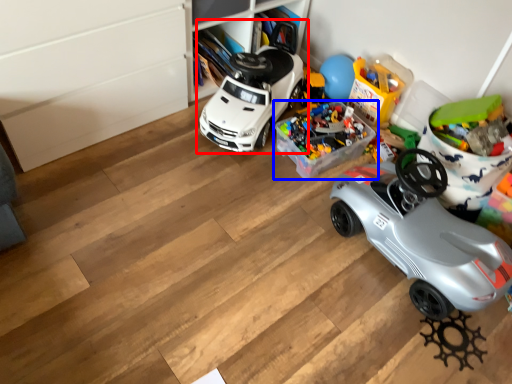
Question: Which object is closer to the camera taking this photo, car (highlighted by a red box) or toy (highlighted by a blue box)?

Choices:
 (A) car
 (B) toy

Answer: (A)